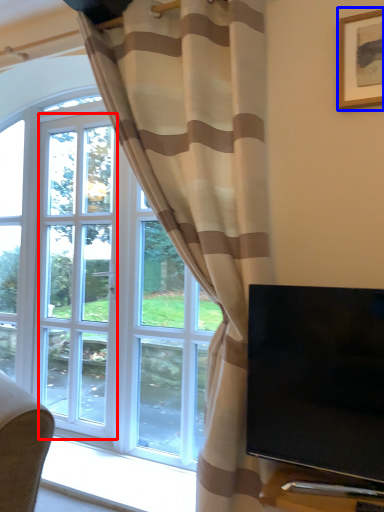
Question: Which object is closer to the camera taking this photo, screen door (highlighted by a red box) or picture frame (highlighted by a blue box)?

Choices:
 (A) screen door
 (B) picture frame

Answer: (B)